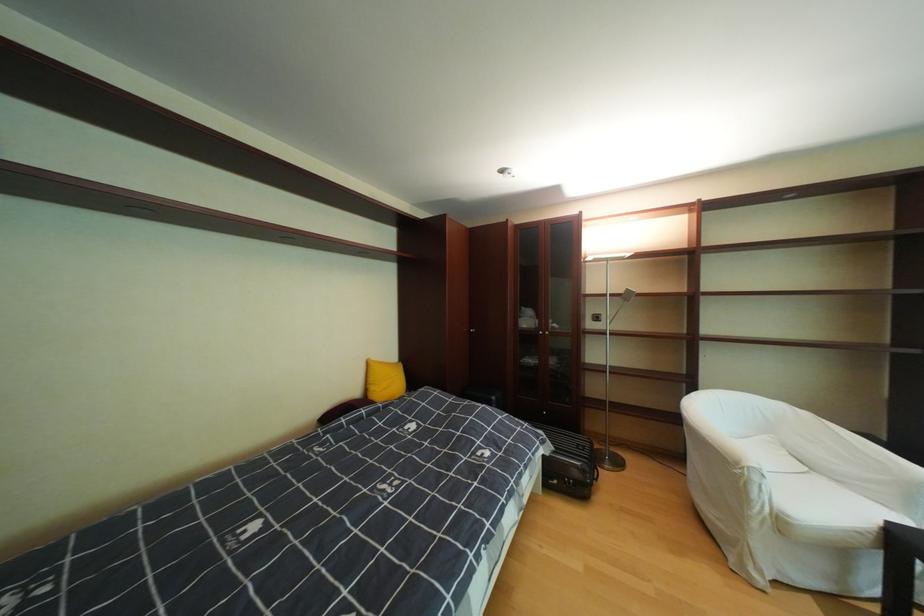
This screenshot has width=924, height=616. I want to click on adjustable lamp head, so click(x=622, y=294).